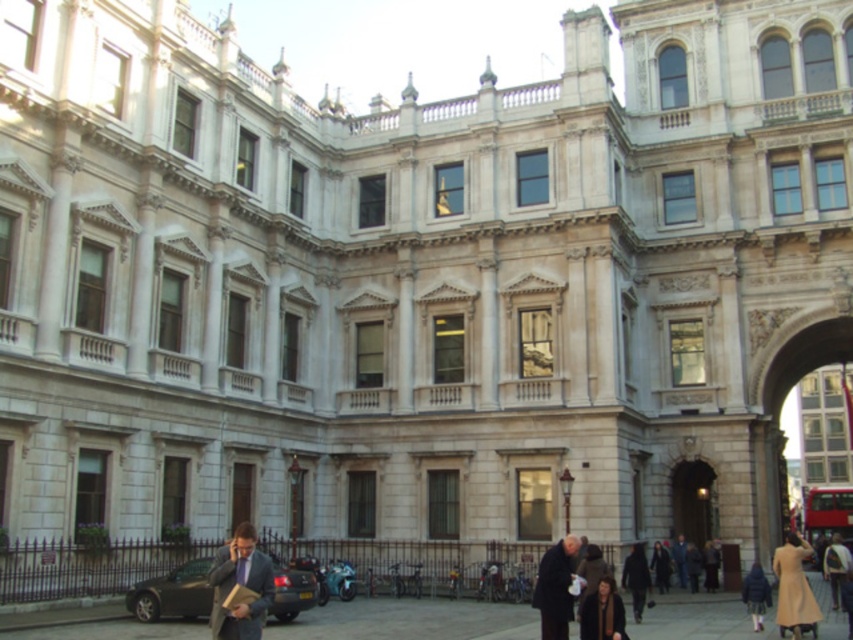
Question: In this image, where is beige wool coat at lower right located relative to red metallic bus at lower right?

Choices:
 (A) right
 (B) left

Answer: (B)

Question: Does smooth concrete pavement at lower center have a smaller size compared to dark fabric coat at lower right?

Choices:
 (A) no
 (B) yes

Answer: (A)

Question: Based on their relative distances, which object is nearer to the dark brown leather coat at lower center?

Choices:
 (A) matte black suit at lower left
 (B) red metallic bus at lower right

Answer: (A)

Question: Based on their relative distances, which object is nearer to the dark fabric coat at lower right?

Choices:
 (A) red metallic bus at lower right
 (B) matte black suit at lower left
 (C) brown wool coat at lower center

Answer: (C)

Question: Is beige wool coat at lower right behind red metallic bus at lower right?

Choices:
 (A) yes
 (B) no

Answer: (B)

Question: Which point is farther from the camera taking this photo?

Choices:
 (A) (759, 611)
 (B) (804, 609)

Answer: (A)